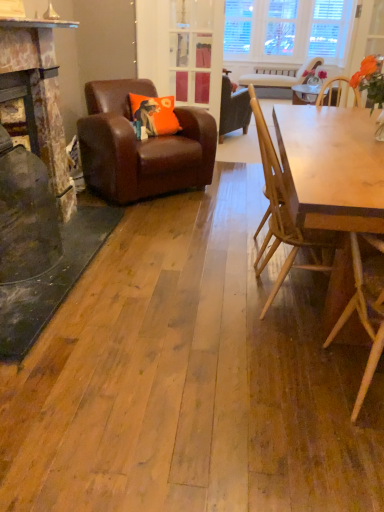
Question: Is light brown wooden chair at right, acting as the fourth chair starting from the back, thinner than brown leather armchair at left, which is the 3th chair from front to back?

Choices:
 (A) no
 (B) yes

Answer: (B)

Question: Is light brown wooden chair at right, positioned as the 1th chair in bottom-to-top order, next to brown leather armchair at left, the 2th chair from the top, and touching it?

Choices:
 (A) yes
 (B) no

Answer: (B)

Question: Is light brown wooden chair at right, the 4th chair when ordered from top to bottom, taller than brown leather armchair at left, the fourth chair from the right?

Choices:
 (A) no
 (B) yes

Answer: (B)

Question: Would you say brown leather armchair at left, the 2th chair from the top, is part of light brown wooden chair at right, which is the 1th chair in front-to-back order,'s contents?

Choices:
 (A) no
 (B) yes

Answer: (A)

Question: From a real-world perspective, is light brown wooden chair at right, which is the 1th chair in front-to-back order, physically below brown leather armchair at left, the 2th chair from the top?

Choices:
 (A) no
 (B) yes

Answer: (A)

Question: Does brown leather armchair at left, the 2th chair from the top, have a lesser width compared to clear glass door at center?

Choices:
 (A) no
 (B) yes

Answer: (A)

Question: Does brown leather armchair at left, which is the 2th chair in back-to-front order, appear on the left side of clear glass door at center?

Choices:
 (A) yes
 (B) no

Answer: (A)

Question: Can you confirm if brown leather armchair at left, the fourth chair from the right, is bigger than clear glass door at center?

Choices:
 (A) yes
 (B) no

Answer: (A)

Question: Is brown leather armchair at left, which is the 2th chair in back-to-front order, directly adjacent to clear glass door at center?

Choices:
 (A) yes
 (B) no

Answer: (B)

Question: From the image's perspective, is brown leather armchair at left, which is the first chair from left to right, below clear glass door at center?

Choices:
 (A) no
 (B) yes

Answer: (B)

Question: Considering the relative sizes of brown leather armchair at left, which is the 3th chair from front to back, and clear glass door at center in the image provided, is brown leather armchair at left, which is the 3th chair from front to back, wider than clear glass door at center?

Choices:
 (A) no
 (B) yes

Answer: (B)

Question: Does clear glass door at center have a lesser width compared to brown leather armchair at left, the 2th chair from the top?

Choices:
 (A) yes
 (B) no

Answer: (A)